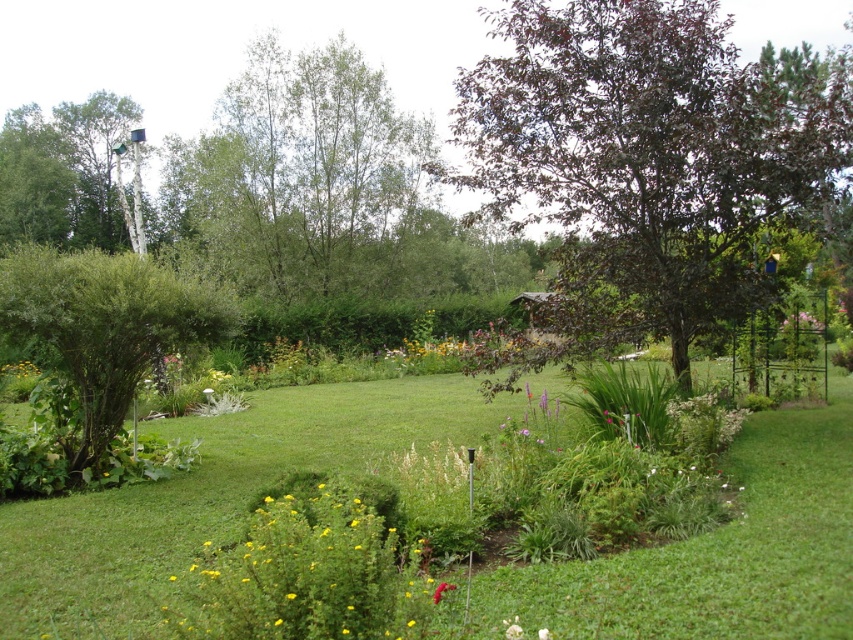
You are planning to plant a new flower bed in your garden and want to ensure proper spacing between the purple glossy tree at upper right and the green leafy bush at left. Given their sizes, which one requires more space to accommodate its growth?

The purple glossy tree at upper right requires more space because it has a larger size compared to the green leafy bush at left.

You are a gardener standing at the center of the garden. You notice two points marked in the scene. The first point is at coordinate point [579,211] and the second is at point [210,323]. Which point is closer to you?

Point [210,323] is closer to you because it is in front of point [579,211], which is behind it.